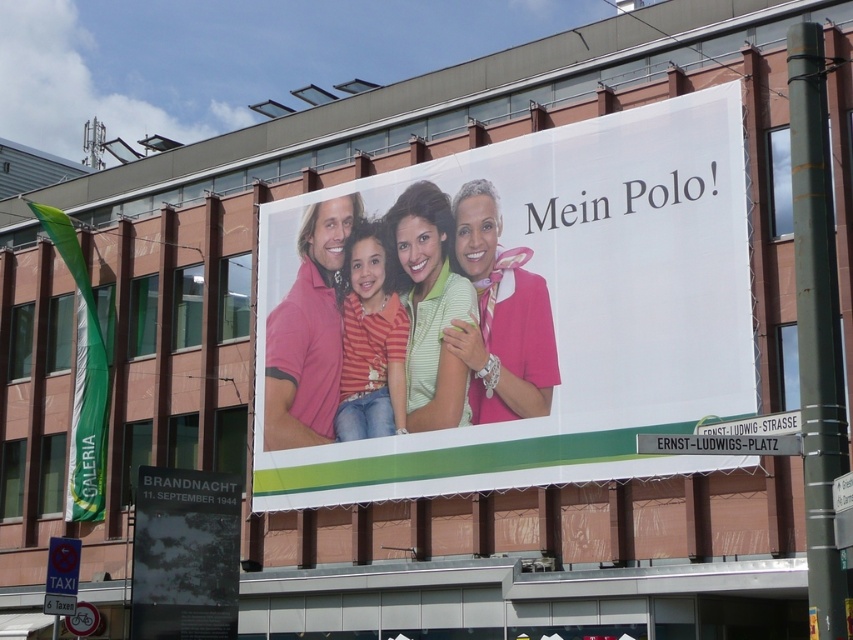
Question: Among these points, which one is farthest from the camera?

Choices:
 (A) (318, 316)
 (B) (442, 403)
 (C) (514, 380)

Answer: (A)

Question: Can you confirm if matte pink polo shirt at center is smaller than black textured poster at lower left?

Choices:
 (A) yes
 (B) no

Answer: (B)

Question: Estimate the real-world distances between objects in this image. Which object is closer to the pink cotton polo shirt at center?

Choices:
 (A) striped cotton shirt at center
 (B) pink satin blouse at center
 (C) green cotton polo shirt at center

Answer: (A)

Question: Is black textured poster at lower left to the left of green cotton polo shirt at center from the viewer's perspective?

Choices:
 (A) yes
 (B) no

Answer: (A)

Question: Is the position of black textured poster at lower left less distant than that of green cotton polo shirt at center?

Choices:
 (A) yes
 (B) no

Answer: (A)

Question: Which point appears closest to the camera in this image?

Choices:
 (A) (514, 316)
 (B) (320, 333)
 (C) (167, 516)

Answer: (C)